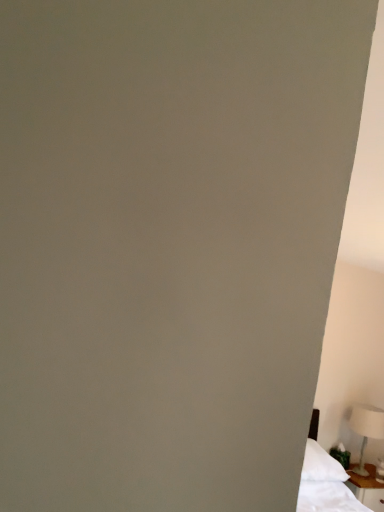
In order to face white plastic table lamp at lower right, should I rotate leftwards or rightwards?

Turn right by 21.773 degrees to look at white plastic table lamp at lower right.

The height and width of the screenshot is (512, 384). Describe the element at coordinates (366, 429) in the screenshot. I see `white plastic table lamp at lower right` at that location.

Image resolution: width=384 pixels, height=512 pixels. In order to click on white plastic table lamp at lower right in this screenshot , I will do `click(366, 429)`.

Describe the element at coordinates (367, 487) in the screenshot. I see `white wood nightstand at lower right` at that location.

Identify the location of white wood nightstand at lower right. (367, 487).

The width and height of the screenshot is (384, 512). What are the coordinates of `white plastic table lamp at lower right` in the screenshot? It's located at (366, 429).

Which is more to the left, white wood nightstand at lower right or white plastic table lamp at lower right?

Positioned to the left is white wood nightstand at lower right.

Between white wood nightstand at lower right and white plastic table lamp at lower right, which one is positioned behind?

white plastic table lamp at lower right is further away from the camera.

Does point (382, 492) come closer to viewer compared to point (352, 418)?

Yes.

From the image's perspective, would you say white wood nightstand at lower right is positioned over white plastic table lamp at lower right?

Actually, white wood nightstand at lower right appears below white plastic table lamp at lower right in the image.

From a real-world perspective, is white wood nightstand at lower right on white plastic table lamp at lower right?

No, from a real-world perspective, white wood nightstand at lower right is not above white plastic table lamp at lower right.

Does white wood nightstand at lower right have a greater width compared to white plastic table lamp at lower right?

Correct, the width of white wood nightstand at lower right exceeds that of white plastic table lamp at lower right.

Between white wood nightstand at lower right and white plastic table lamp at lower right, which one has more height?

white plastic table lamp at lower right.

Considering the sizes of white wood nightstand at lower right and white plastic table lamp at lower right in the image, is white wood nightstand at lower right bigger or smaller than white plastic table lamp at lower right?

Considering their sizes, white wood nightstand at lower right takes up more space than white plastic table lamp at lower right.

Would you say white wood nightstand at lower right is inside or outside white plastic table lamp at lower right?

white wood nightstand at lower right is located beyond the bounds of white plastic table lamp at lower right.

Is white wood nightstand at lower right next to white plastic table lamp at lower right and touching it?

No, white wood nightstand at lower right is not with white plastic table lamp at lower right.

Is white plastic table lamp at lower right at the back of white wood nightstand at lower right?

No.

How many degrees apart are the facing directions of white wood nightstand at lower right and white plastic table lamp at lower right?

The angle between the facing direction of white wood nightstand at lower right and the facing direction of white plastic table lamp at lower right is 1.43 degrees.

Where is `table lamp behind the white wood nightstand at lower right`? The height and width of the screenshot is (512, 384). table lamp behind the white wood nightstand at lower right is located at coordinates (366, 429).

Can you confirm if white plastic table lamp at lower right is positioned to the right of white wood nightstand at lower right?

Yes, white plastic table lamp at lower right is to the right of white wood nightstand at lower right.

Which object is further away from the camera taking this photo, white plastic table lamp at lower right or white wood nightstand at lower right?

Positioned behind is white plastic table lamp at lower right.

Is point (380, 425) positioned in front of point (362, 481)?

No, (380, 425) is behind (362, 481).

From the image's perspective, which is above, white plastic table lamp at lower right or white wood nightstand at lower right?

white plastic table lamp at lower right, from the image's perspective.

From a real-world perspective, which object stands above the other?

white plastic table lamp at lower right.

Does white plastic table lamp at lower right have a greater width compared to white wood nightstand at lower right?

No.

Between white plastic table lamp at lower right and white wood nightstand at lower right, which one has more height?

With more height is white plastic table lamp at lower right.

Between white plastic table lamp at lower right and white wood nightstand at lower right, which one has smaller size?

Smaller between the two is white plastic table lamp at lower right.

Can we say white plastic table lamp at lower right lies outside white wood nightstand at lower right?

That's correct, white plastic table lamp at lower right is outside of white wood nightstand at lower right.

Is white plastic table lamp at lower right not close to white wood nightstand at lower right?

white plastic table lamp at lower right is near white wood nightstand at lower right, not far away.

Is white plastic table lamp at lower right facing towards white wood nightstand at lower right?

No, white plastic table lamp at lower right is not oriented towards white wood nightstand at lower right.

Measure the distance between white plastic table lamp at lower right and white wood nightstand at lower right.

The distance of white plastic table lamp at lower right from white wood nightstand at lower right is 11.57 inches.

At what (x,y) coordinates should I click in order to perform the action: click on nightstand below the white plastic table lamp at lower right (from the image's perspective). Please return your answer as a coordinate pair (x, y). Looking at the image, I should click on (367, 487).

Locate an element on the screen. nightstand directly beneath the white plastic table lamp at lower right (from a real-world perspective) is located at coordinates (367, 487).

You are a GUI agent. You are given a task and a screenshot of the screen. Output one action in this format:
    pyautogui.click(x=<x>, y=<y>)
    Task: Click on the nightstand lying in front of the white plastic table lamp at lower right
    
    Given the screenshot: What is the action you would take?
    pyautogui.click(x=367, y=487)